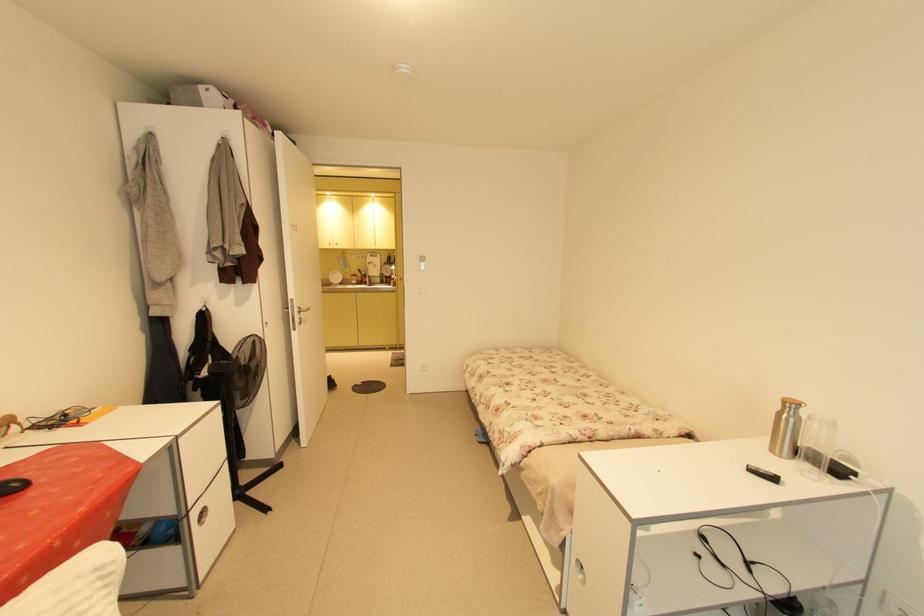
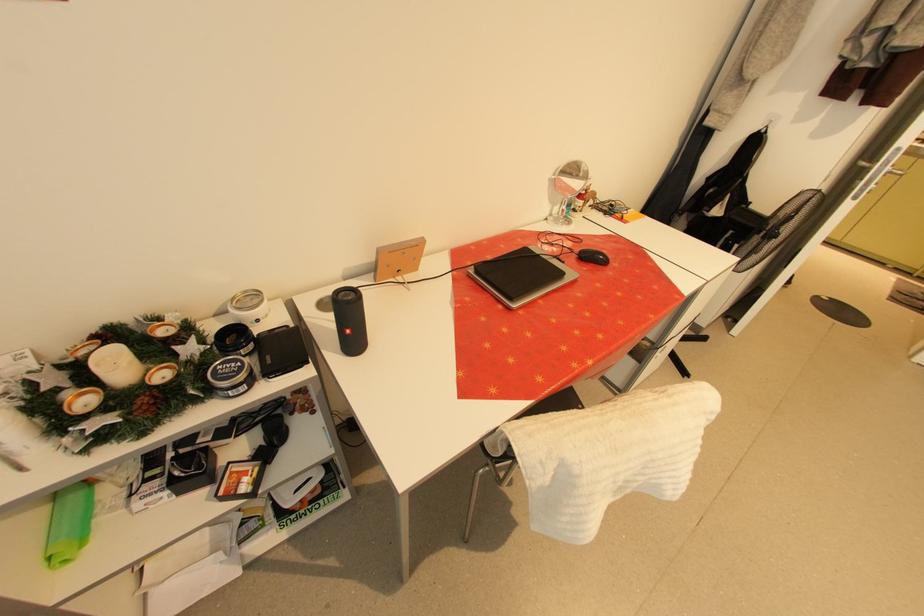
The first image is from the beginning of the video and the second image is from the end. How did the camera likely rotate when shooting the video?

The camera rotated toward left-down.